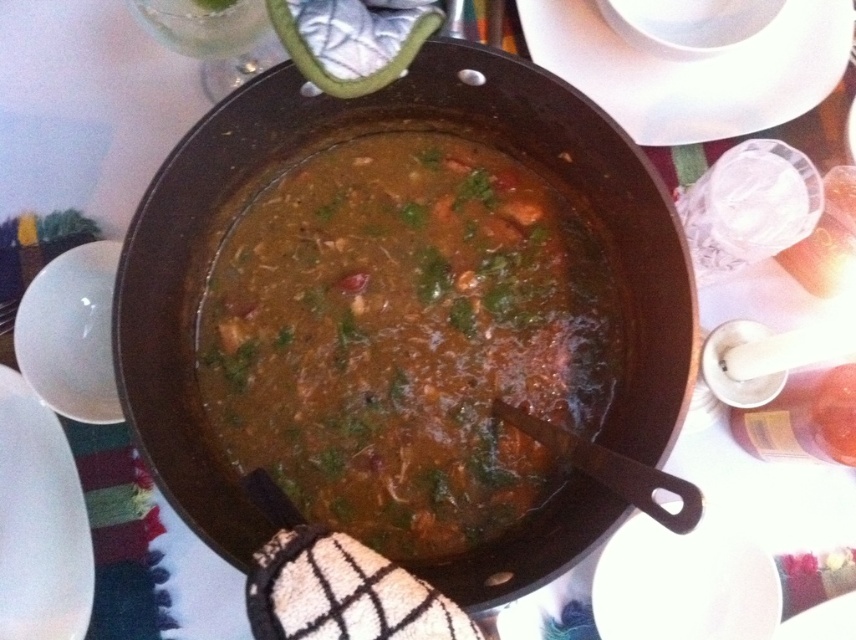
Does white matte plate at lower left have a greater height compared to white glossy plate at lower right?

Yes, white matte plate at lower left is taller than white glossy plate at lower right.

I want to click on white matte plate at lower left, so coord(39,522).

In order to click on white matte plate at lower left in this screenshot , I will do `click(39, 522)`.

Is the position of white glossy plate at upper center less distant than that of white glossy plate at lower right?

No, white glossy plate at upper center is further to the viewer.

Which is behind, point (801, 90) or point (752, 541)?

The point (801, 90) is behind.

The image size is (856, 640). I want to click on white glossy plate at upper center, so click(x=694, y=70).

Does white glossy plate at upper center have a lesser width compared to white matte plate at lower left?

Incorrect, white glossy plate at upper center's width is not less than white matte plate at lower left's.

Can you confirm if white glossy plate at upper center is positioned to the left of white matte plate at lower left?

No, white glossy plate at upper center is not to the left of white matte plate at lower left.

Is point (724, 116) positioned in front of point (55, 618)?

No, (724, 116) is behind (55, 618).

The height and width of the screenshot is (640, 856). I want to click on white glossy plate at upper center, so click(x=694, y=70).